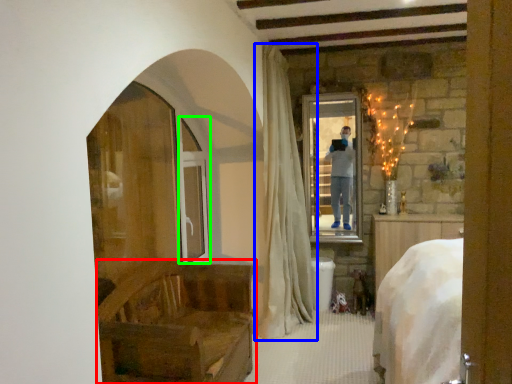
Question: Which object is positioned farthest from furniture (highlighted by a red box)? Select from curtain (highlighted by a blue box) and screen door (highlighted by a green box).

Choices:
 (A) curtain
 (B) screen door

Answer: (B)